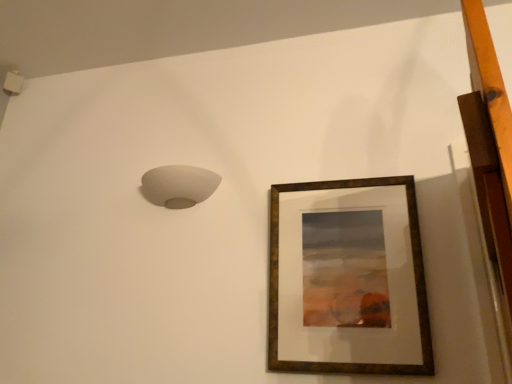
Question: In the image, is white matte lampshade at upper left on the left side or the right side of brown wooden picture frame at upper right?

Choices:
 (A) left
 (B) right

Answer: (A)

Question: From a real-world perspective, is white matte lampshade at upper left above or below brown wooden picture frame at upper right?

Choices:
 (A) above
 (B) below

Answer: (A)

Question: Does point (200, 188) appear closer or farther from the camera than point (399, 180)?

Choices:
 (A) farther
 (B) closer

Answer: (A)

Question: In the image, is brown wooden picture frame at upper right on the left side or the right side of white matte lampshade at upper left?

Choices:
 (A) right
 (B) left

Answer: (A)

Question: From the image's perspective, is brown wooden picture frame at upper right located above or below white matte lampshade at upper left?

Choices:
 (A) above
 (B) below

Answer: (B)

Question: Considering the positions of brown wooden picture frame at upper right and white matte lampshade at upper left in the image, is brown wooden picture frame at upper right bigger or smaller than white matte lampshade at upper left?

Choices:
 (A) small
 (B) big

Answer: (B)

Question: Looking at their shapes, would you say brown wooden picture frame at upper right is wider or thinner than white matte lampshade at upper left?

Choices:
 (A) thin
 (B) wide

Answer: (A)